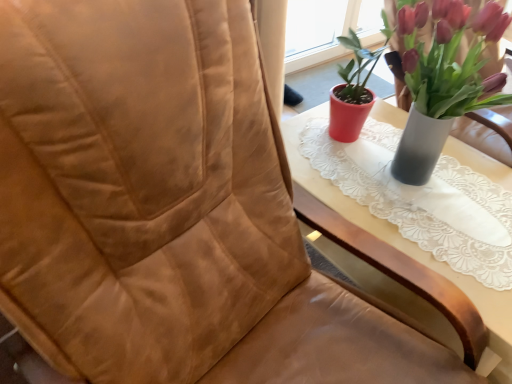
At what (x,y) coordinates should I click in order to perform the action: click on vacant space positioned to the left of matte red pot at upper right. Please return your answer as a coordinate pair (x, y). The image size is (512, 384). Looking at the image, I should click on (329, 172).